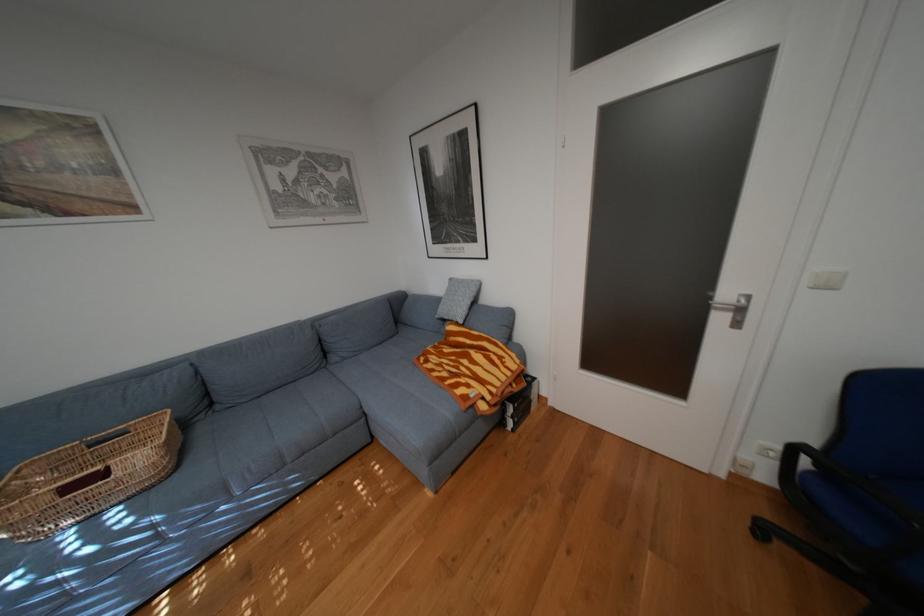
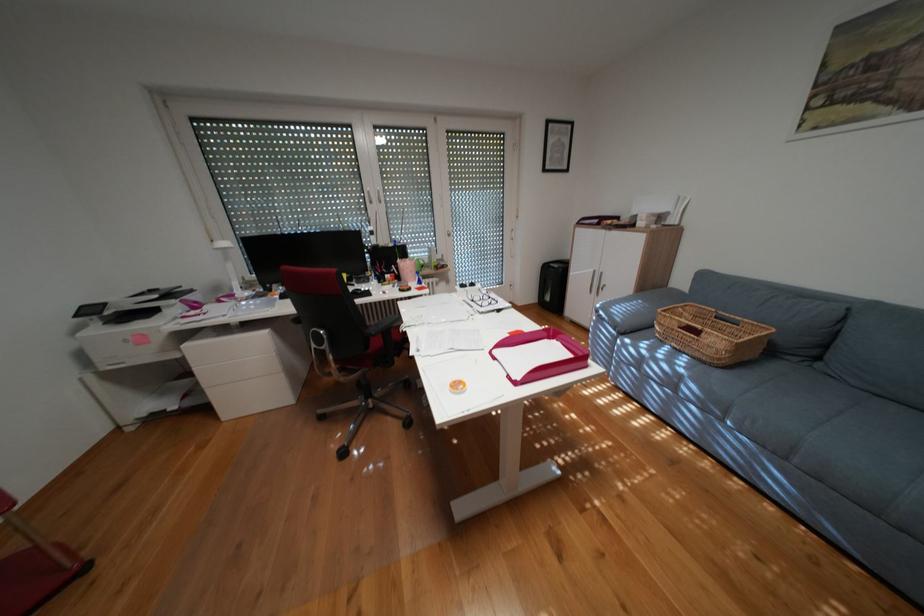
The first image is from the beginning of the video and the second image is from the end. How did the camera likely rotate when shooting the video?

The camera rotated toward left-down.